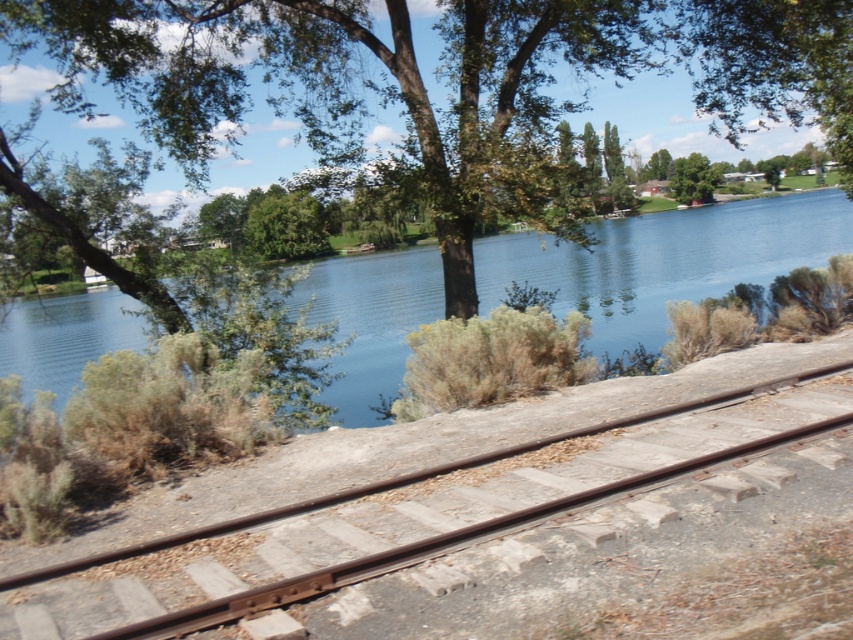
You are standing at the riverside and see the smooth metal train track at center and the blue water at center. Which object is closer to you?

The smooth metal train track at center is closer to you since it is in front of the blue water at center.